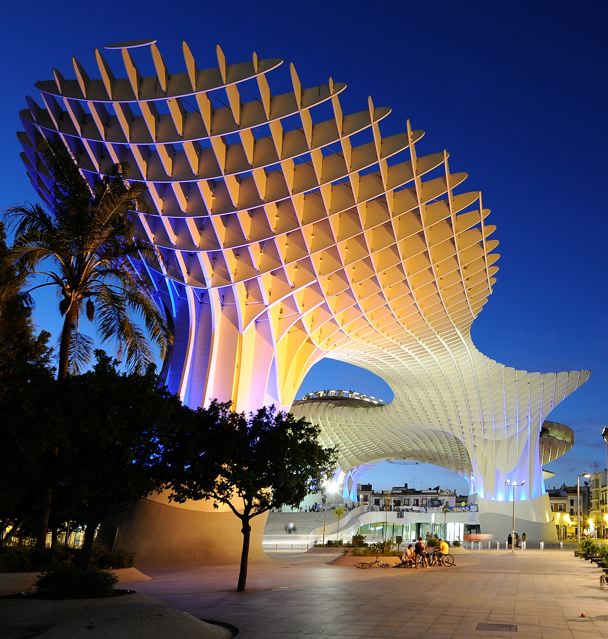
Identify the location of grate. (495, 624).